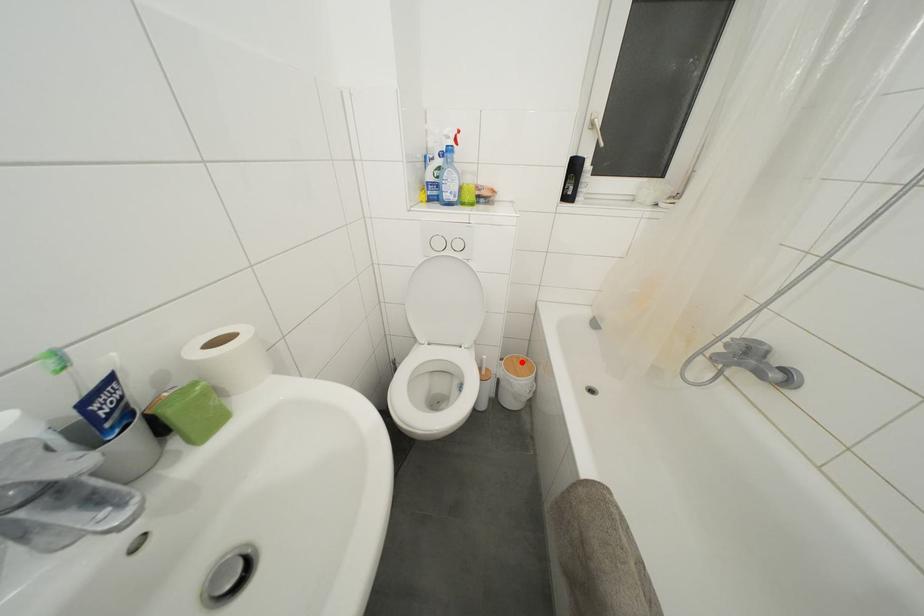
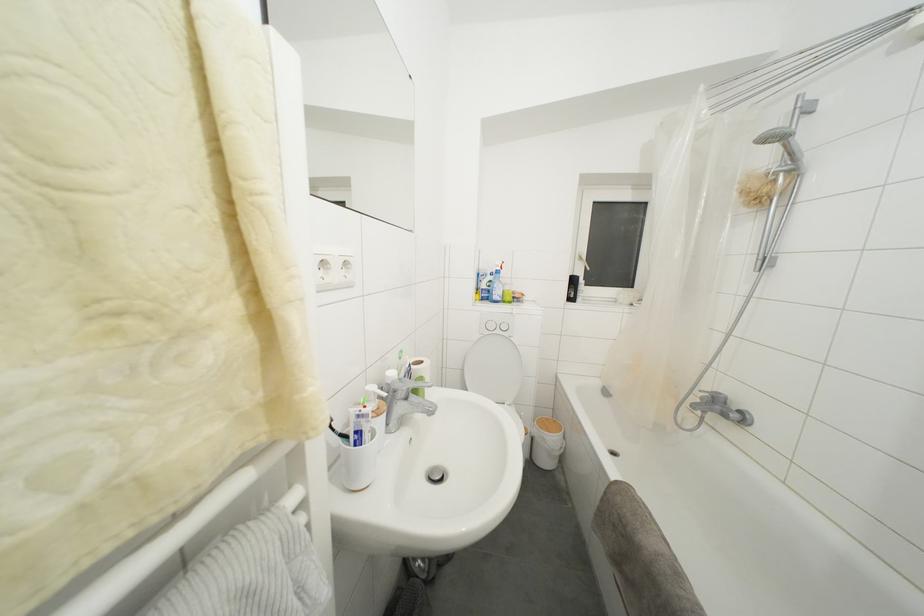
Find the pixel in the second image that matches the highlighted location in the first image.

(552, 424)